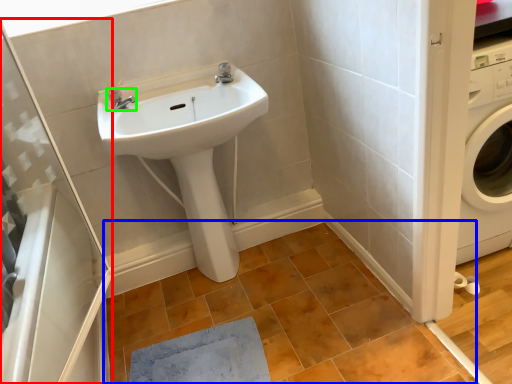
Question: Which is farther away from shower door (highlighted by a red box)? tile (highlighted by a blue box) or tap (highlighted by a green box)?

Choices:
 (A) tile
 (B) tap

Answer: (B)